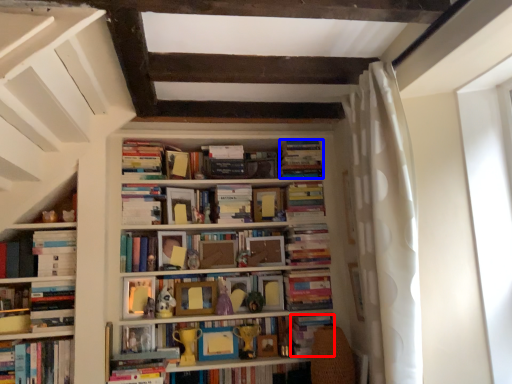
Question: Which of the following is the closest to the observer, paperback book (highlighted by a red box) or book (highlighted by a blue box)?

Choices:
 (A) paperback book
 (B) book

Answer: (A)